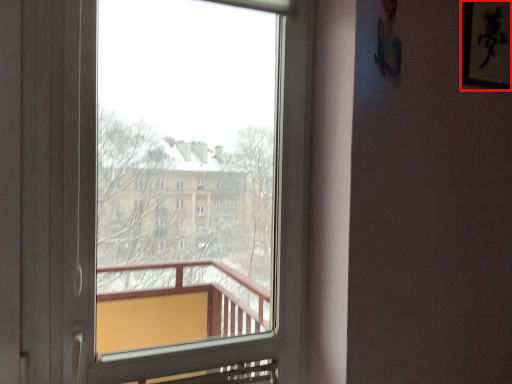
Question: From the image's perspective, where is picture frame (annotated by the red box) located relative to window?

Choices:
 (A) above
 (B) below

Answer: (A)